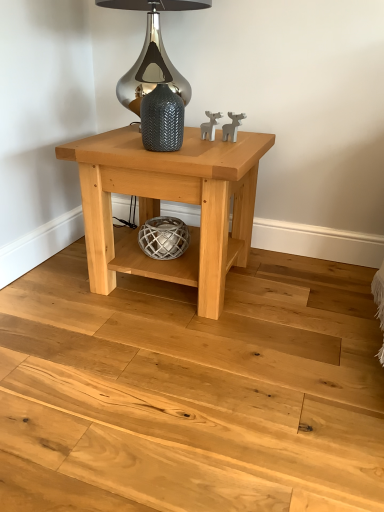
The width and height of the screenshot is (384, 512). What are the coordinates of `free space in front of natural wood table at center` in the screenshot? It's located at (168, 362).